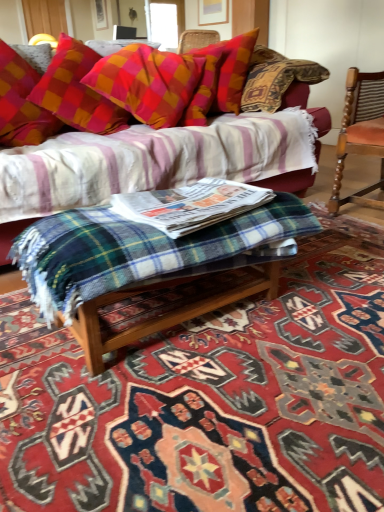
Question: Is plaid fabric pillow at upper center taller than plaid fabric couch at upper center?

Choices:
 (A) yes
 (B) no

Answer: (B)

Question: Is plaid fabric pillow at upper center at the left side of plaid fabric couch at upper center?

Choices:
 (A) yes
 (B) no

Answer: (A)

Question: From the image's perspective, does plaid fabric pillow at upper center appear lower than plaid fabric couch at upper center?

Choices:
 (A) no
 (B) yes

Answer: (A)

Question: From a real-world perspective, does plaid fabric pillow at upper center stand above plaid fabric couch at upper center?

Choices:
 (A) no
 (B) yes

Answer: (B)

Question: Considering the relative sizes of plaid fabric pillow at upper center and plaid fabric couch at upper center in the image provided, is plaid fabric pillow at upper center shorter than plaid fabric couch at upper center?

Choices:
 (A) yes
 (B) no

Answer: (A)

Question: In terms of width, does wooden chair with striped upholstery at right look wider or thinner when compared to green plaid blanket at center?

Choices:
 (A) thin
 (B) wide

Answer: (B)

Question: From their relative heights in the image, would you say wooden chair with striped upholstery at right is taller or shorter than green plaid blanket at center?

Choices:
 (A) short
 (B) tall

Answer: (B)

Question: From the image's perspective, is wooden chair with striped upholstery at right positioned above or below green plaid blanket at center?

Choices:
 (A) below
 (B) above

Answer: (B)

Question: Is wooden chair with striped upholstery at right inside or outside of green plaid blanket at center?

Choices:
 (A) outside
 (B) inside

Answer: (A)

Question: Considering their positions, is green plaid blanket at center located in front of or behind plaid fabric pillow at upper center?

Choices:
 (A) behind
 (B) front

Answer: (B)

Question: Does point (233, 219) appear closer or farther from the camera than point (165, 103)?

Choices:
 (A) farther
 (B) closer

Answer: (B)

Question: Looking at their shapes, would you say green plaid blanket at center is wider or thinner than plaid fabric pillow at upper center?

Choices:
 (A) thin
 (B) wide

Answer: (A)

Question: Considering the positions of green plaid blanket at center and plaid fabric pillow at upper center in the image, is green plaid blanket at center taller or shorter than plaid fabric pillow at upper center?

Choices:
 (A) short
 (B) tall

Answer: (A)

Question: Is plaid fabric couch at upper center spatially inside green plaid blanket at center, or outside of it?

Choices:
 (A) inside
 (B) outside

Answer: (B)

Question: Is plaid fabric couch at upper center wider or thinner than green plaid blanket at center?

Choices:
 (A) wide
 (B) thin

Answer: (A)